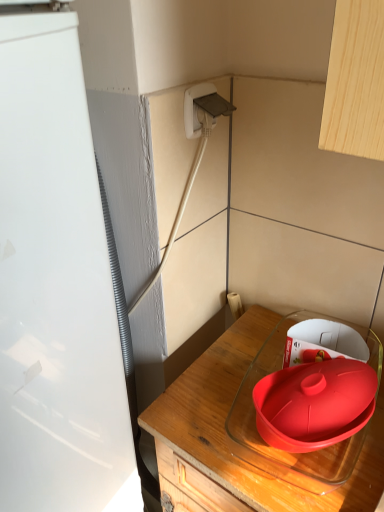
The image size is (384, 512). What do you see at coordinates (236, 444) in the screenshot?
I see `transparent glass container at lower right` at bounding box center [236, 444].

Image resolution: width=384 pixels, height=512 pixels. Describe the element at coordinates (56, 287) in the screenshot. I see `white glossy refrigerator at left` at that location.

Locate an element on the screen. white plastic plug at upper center is located at coordinates (203, 108).

Could you measure the distance between white glossy refrigerator at left and transparent glass container at lower right?

The distance of white glossy refrigerator at left from transparent glass container at lower right is 9.65 inches.

Between white glossy refrigerator at left and transparent glass container at lower right, which one appears on the right side from the viewer's perspective?

From the viewer's perspective, transparent glass container at lower right appears more on the right side.

Is white glossy refrigerator at left closer to camera compared to transparent glass container at lower right?

Yes, the depth of white glossy refrigerator at left is less than that of transparent glass container at lower right.

Is white glossy refrigerator at left outside of transparent glass container at lower right?

Yes, white glossy refrigerator at left is not within transparent glass container at lower right.

In the image, is white plastic plug at upper center positioned in front of or behind white glossy refrigerator at left?

white plastic plug at upper center is behind white glossy refrigerator at left.

Looking at their sizes, would you say white plastic plug at upper center is wider or thinner than white glossy refrigerator at left?

Clearly, white plastic plug at upper center has less width compared to white glossy refrigerator at left.

From the picture: Is white plastic plug at upper center placed right next to white glossy refrigerator at left?

No, white plastic plug at upper center is not touching white glossy refrigerator at left.

Find the location of a particular element. appliance located underneath the white plastic plug at upper center (from a real-world perspective) is located at coordinates (56, 287).

Considering the relative sizes of transparent glass container at lower right and white plastic plug at upper center in the image provided, is transparent glass container at lower right shorter than white plastic plug at upper center?

No, transparent glass container at lower right is not shorter than white plastic plug at upper center.

In the scene shown: Is transparent glass container at lower right spatially inside white plastic plug at upper center, or outside of it?

transparent glass container at lower right exists outside the volume of white plastic plug at upper center.

Where is `electric outlet on the left of transparent glass container at lower right`? This screenshot has height=512, width=384. electric outlet on the left of transparent glass container at lower right is located at coordinates (203, 108).

Measure the distance between white glossy refrigerator at left and white plastic plug at upper center.

The distance of white glossy refrigerator at left from white plastic plug at upper center is 16.23 inches.

Can you confirm if white glossy refrigerator at left is taller than white plastic plug at upper center?

Correct, white glossy refrigerator at left is much taller as white plastic plug at upper center.

You are a GUI agent. You are given a task and a screenshot of the screen. Output one action in this format:
    pyautogui.click(x=<x>, y=<y>)
    Task: Click on the appliance below the white plastic plug at upper center (from the image's perspective)
    
    Given the screenshot: What is the action you would take?
    coord(56,287)

Does white glossy refrigerator at left contain white plastic plug at upper center?

Actually, white plastic plug at upper center is outside white glossy refrigerator at left.

Considering the sizes of objects white plastic plug at upper center and transparent glass container at lower right in the image provided, who is smaller, white plastic plug at upper center or transparent glass container at lower right?

Smaller between the two is white plastic plug at upper center.

Is white plastic plug at upper center inside or outside of transparent glass container at lower right?

white plastic plug at upper center lies outside transparent glass container at lower right.

Locate an element on the screen. countertop below the white plastic plug at upper center (from the image's perspective) is located at coordinates (236, 444).

From the image's perspective, which is above, white plastic plug at upper center or transparent glass container at lower right?

white plastic plug at upper center, from the image's perspective.

How distant is transparent glass container at lower right from white glossy refrigerator at left?

transparent glass container at lower right and white glossy refrigerator at left are 9.65 inches apart.

Considering the sizes of transparent glass container at lower right and white glossy refrigerator at left in the image, is transparent glass container at lower right bigger or smaller than white glossy refrigerator at left?

Considering their sizes, transparent glass container at lower right takes up more space than white glossy refrigerator at left.

Can you confirm if transparent glass container at lower right is thinner than white glossy refrigerator at left?

Incorrect, the width of transparent glass container at lower right is not less than that of white glossy refrigerator at left.

Looking at this image, is transparent glass container at lower right far away from white glossy refrigerator at left?

Actually, transparent glass container at lower right and white glossy refrigerator at left are a little close together.

Where is `countertop lying on the right of white glossy refrigerator at left`? countertop lying on the right of white glossy refrigerator at left is located at coordinates (236, 444).

Locate an element on the screen. appliance that appears below the white plastic plug at upper center (from a real-world perspective) is located at coordinates (56, 287).

Considering their positions, is transparent glass container at lower right positioned closer to white glossy refrigerator at left than white plastic plug at upper center?

transparent glass container at lower right.

Which object lies nearer to the anchor point white glossy refrigerator at left, white plastic plug at upper center or transparent glass container at lower right?

transparent glass container at lower right.

Estimate the real-world distances between objects in this image. Which object is further from transparent glass container at lower right, white plastic plug at upper center or white glossy refrigerator at left?

Based on the image, white plastic plug at upper center appears to be further to transparent glass container at lower right.

When comparing their distances from white plastic plug at upper center, does white glossy refrigerator at left or transparent glass container at lower right seem closer?

white glossy refrigerator at left is positioned closer to the anchor white plastic plug at upper center.

From the image, which object appears to be nearer to transparent glass container at lower right, white glossy refrigerator at left or white plastic plug at upper center?

The object closer to transparent glass container at lower right is white glossy refrigerator at left.

From the image, which object appears to be nearer to white plastic plug at upper center, transparent glass container at lower right or white glossy refrigerator at left?

white glossy refrigerator at left is closer to white plastic plug at upper center.

The width and height of the screenshot is (384, 512). Find the location of `appliance that lies between white plastic plug at upper center and transparent glass container at lower right from top to bottom`. appliance that lies between white plastic plug at upper center and transparent glass container at lower right from top to bottom is located at coordinates (56, 287).